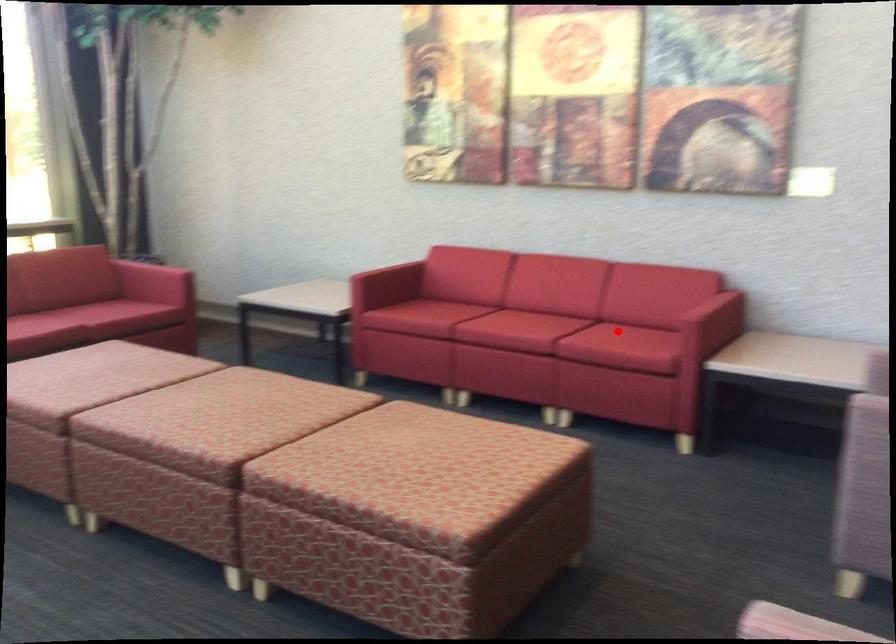
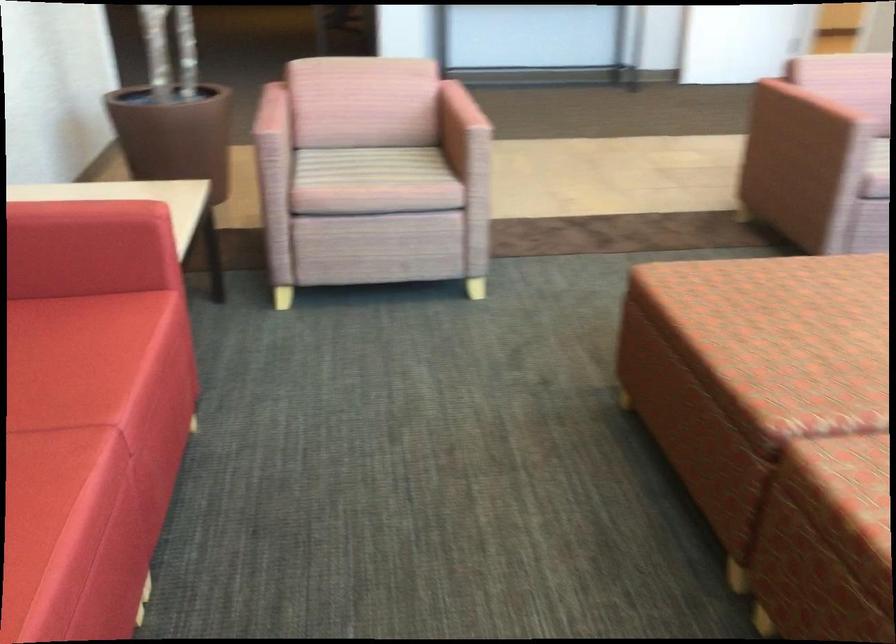
Question: I am providing you with two images of the same scene from different viewpoints. A red point is marked on the first image. Can you still see the location of the red point in image 2?

Choices:
 (A) Yes
 (B) No

Answer: (A)